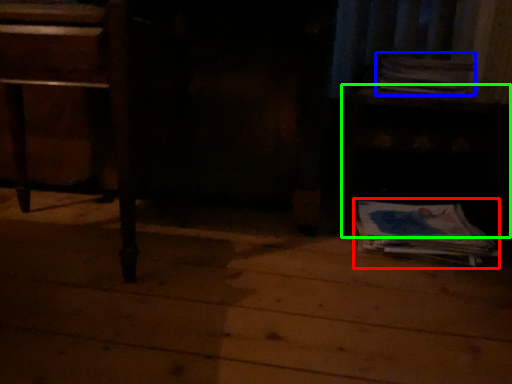
Question: Based on their relative distances, which object is farther from paperback book (highlighted by a red box)? Choose from paperback book (highlighted by a blue box) and table (highlighted by a green box).

Choices:
 (A) paperback book
 (B) table

Answer: (A)